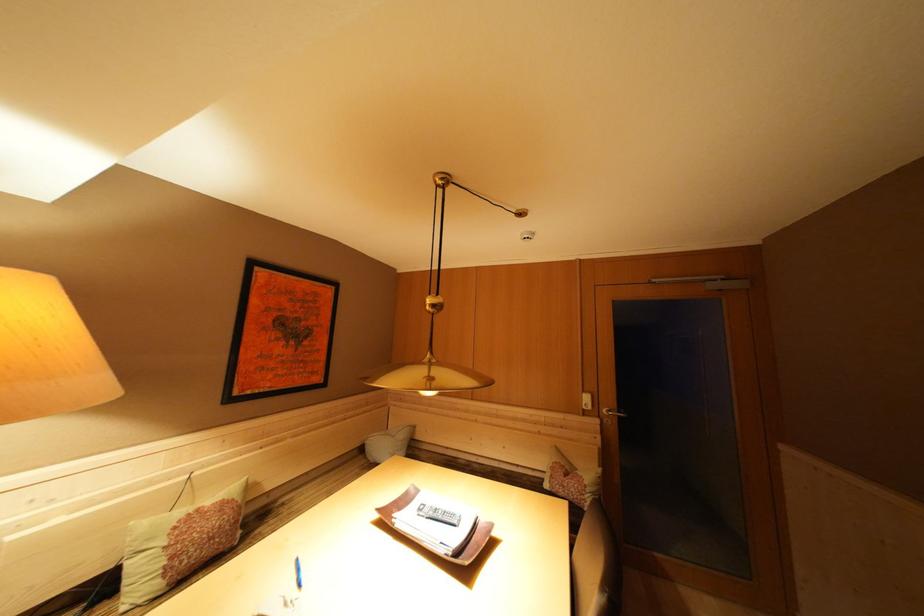
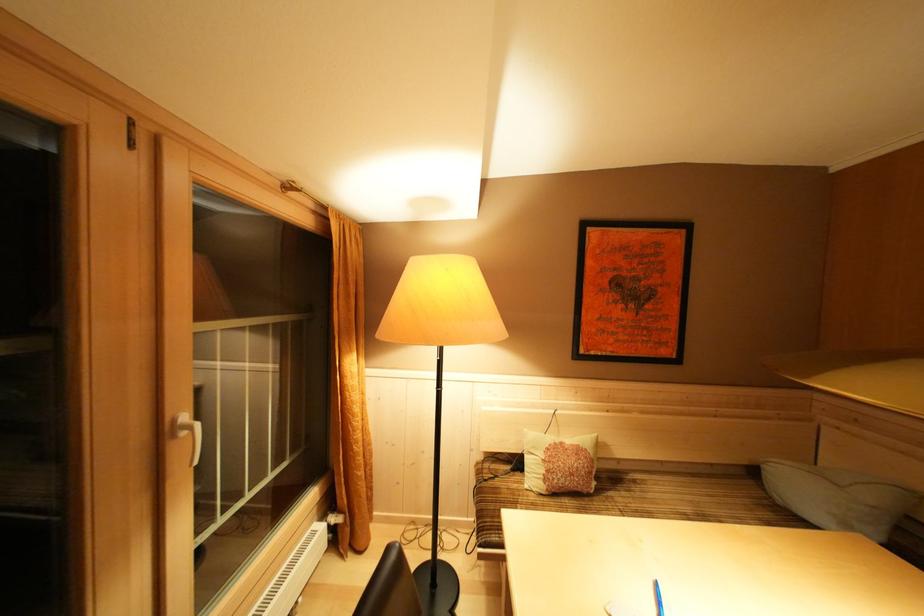
Locate, in the second image, the point that corresponds to (347,461) in the first image.

(718, 468)